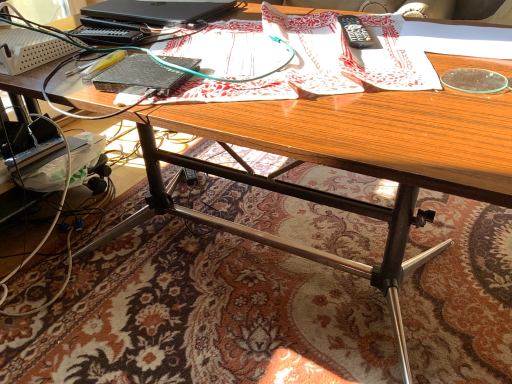
Question: From a real-world perspective, relative to black matte laptop at upper left, is patterned paper at center vertically above or below?

Choices:
 (A) below
 (B) above

Answer: (A)

Question: Is point (239, 87) closer or farther from the camera than point (154, 21)?

Choices:
 (A) farther
 (B) closer

Answer: (B)

Question: Which object is the farthest from the black matte laptop at upper left?

Choices:
 (A) patterned paper at center
 (B) black plastic remote control at upper right

Answer: (B)

Question: Based on their relative distances, which object is nearer to the black matte laptop at upper left?

Choices:
 (A) patterned paper at center
 (B) black plastic remote control at upper right

Answer: (A)